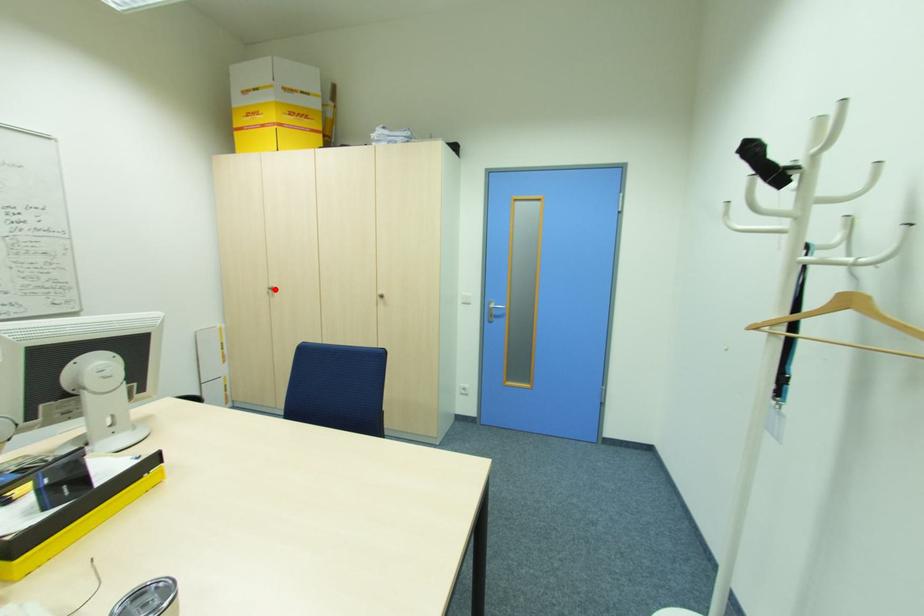
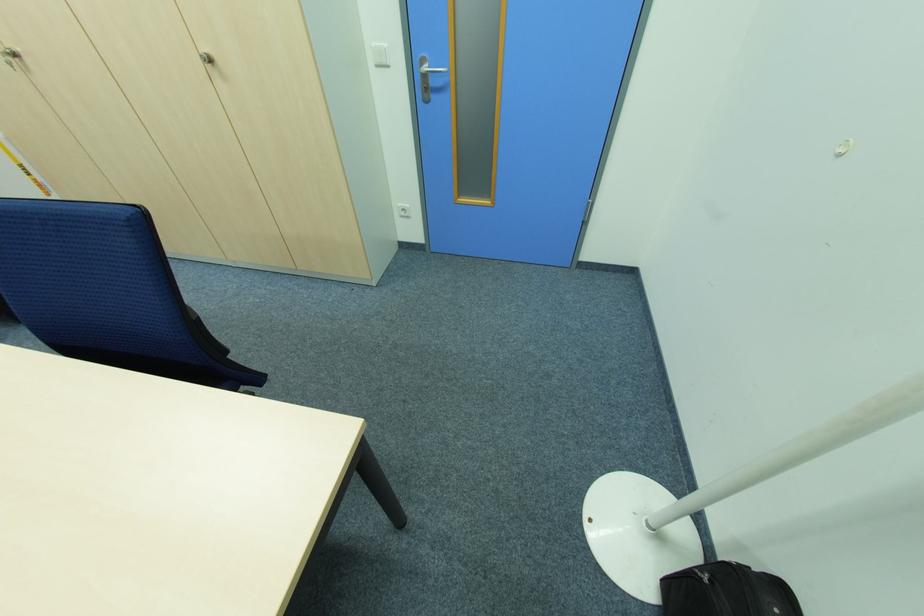
The point at the highlighted location is marked in the first image. Where is the corresponding point in the second image?

(18, 55)